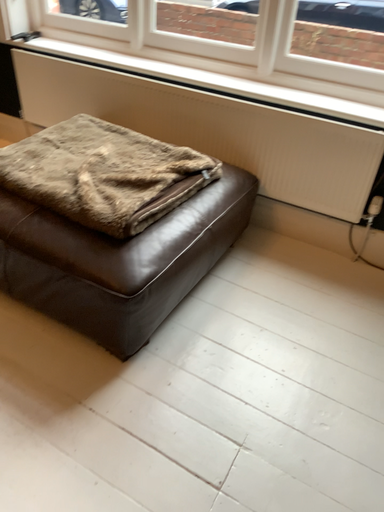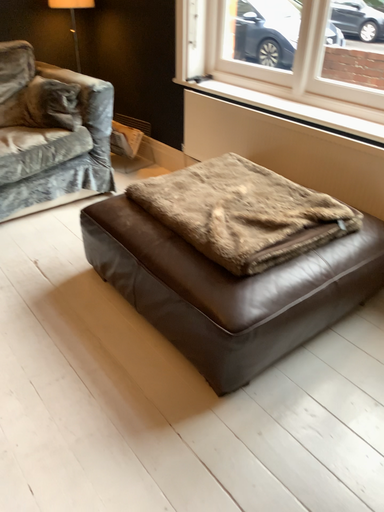
Question: How did the camera likely rotate when shooting the video?

Choices:
 (A) rotated right
 (B) rotated left

Answer: (B)